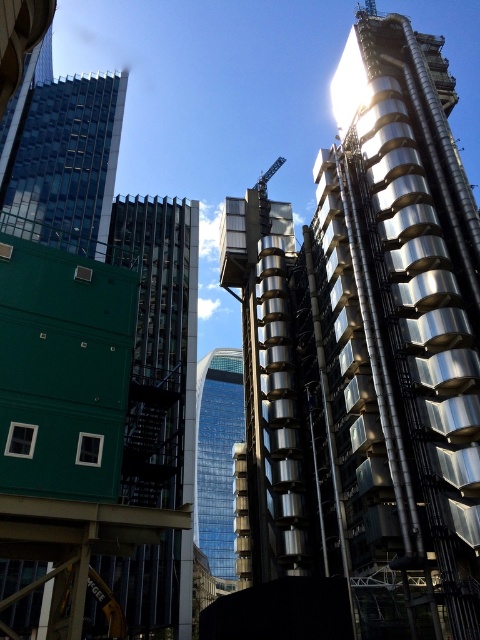
Question: Does metallic silver building at center appear over transparent glass skyscraper at center?

Choices:
 (A) yes
 (B) no

Answer: (A)

Question: Which point is farther from the camera taking this photo?

Choices:
 (A) (289, 472)
 (B) (215, 484)

Answer: (B)

Question: Where is metallic silver building at center located in relation to transparent glass skyscraper at center in the image?

Choices:
 (A) right
 (B) left

Answer: (A)

Question: Is metallic silver building at center thinner than transparent glass skyscraper at center?

Choices:
 (A) no
 (B) yes

Answer: (A)